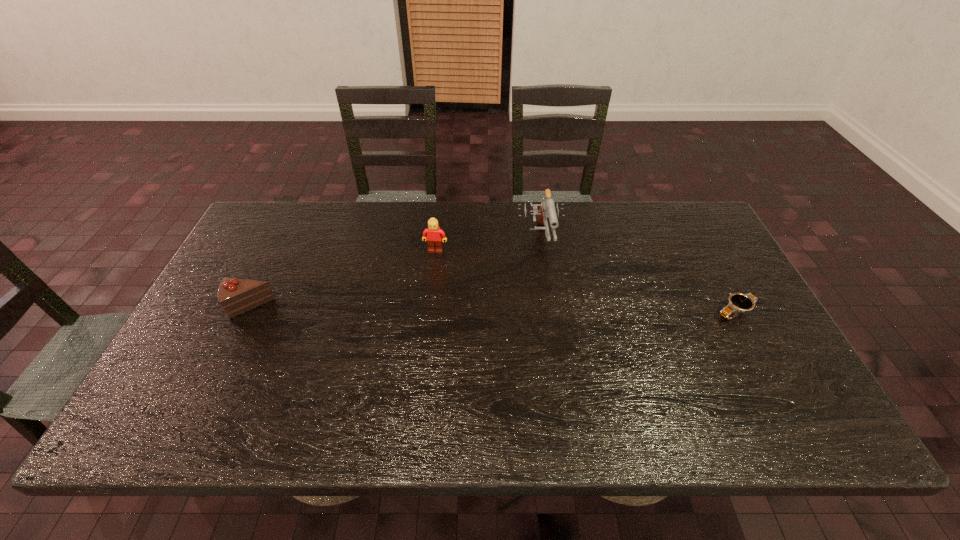
In order to click on free region that satisfies the following two spatial constraints: 1. on the back side of the leftmost object; 2. on the right side of the tallest object in this screenshot , I will do `click(282, 240)`.

Find the location of a particular element. free spot that satisfies the following two spatial constraints: 1. on the front side of the third tallest object; 2. on the left side of the rightmost object is located at coordinates (248, 312).

Image resolution: width=960 pixels, height=540 pixels. Identify the location of vacant region that satisfies the following two spatial constraints: 1. on the back side of the leftmost object; 2. on the left side of the gun. (282, 240).

Identify the location of free location that satisfies the following two spatial constraints: 1. on the back side of the gun; 2. on the left side of the second shortest object. (282, 240).